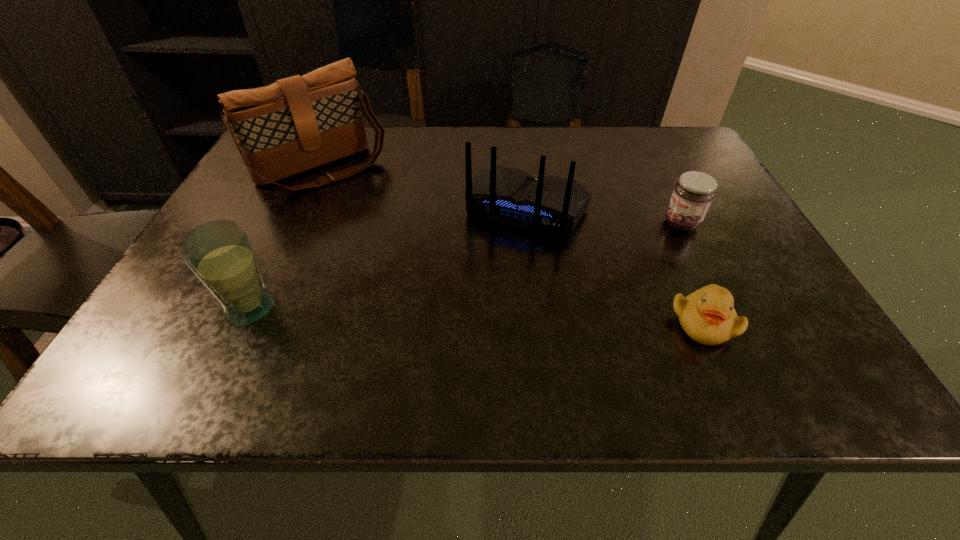
Identify the location of duckling that is at the right edge. Image resolution: width=960 pixels, height=540 pixels. (707, 316).

This screenshot has height=540, width=960. In order to click on jam at the right edge in this screenshot , I will do `click(693, 194)`.

Identify the location of object present at the far left corner. Image resolution: width=960 pixels, height=540 pixels. (296, 124).

Find the location of `object that is at the near left corner`. object that is at the near left corner is located at coordinates pos(220,253).

Where is `object that is at the near right corner`? The height and width of the screenshot is (540, 960). object that is at the near right corner is located at coordinates 707,316.

The width and height of the screenshot is (960, 540). Find the location of `vacant space at the far edge`. vacant space at the far edge is located at coordinates (391, 152).

Image resolution: width=960 pixels, height=540 pixels. Find the location of `vacant space at the left edge of the desktop`. vacant space at the left edge of the desktop is located at coordinates (284, 213).

Locate an element on the screen. This screenshot has width=960, height=540. blank space at the right edge of the desktop is located at coordinates (662, 195).

In the image, there is a desktop. Where is `vacant space at the near left corner`? The image size is (960, 540). vacant space at the near left corner is located at coordinates (217, 315).

What are the coordinates of `vacant area at the far right corner of the desktop` in the screenshot? It's located at (643, 133).